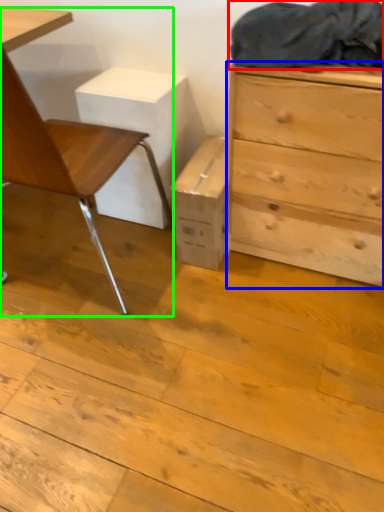
Question: Based on their relative distances, which object is farther from laundry (highlighted by a red box)? Choose from chest of drawers (highlighted by a blue box) and chair (highlighted by a green box).

Choices:
 (A) chest of drawers
 (B) chair

Answer: (B)